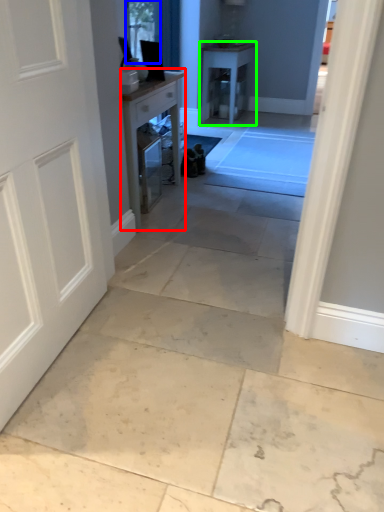
Question: Based on their relative distances, which object is nearer to table (highlighted by a red box)? Choose from window screen (highlighted by a blue box) and table (highlighted by a green box).

Choices:
 (A) window screen
 (B) table

Answer: (A)